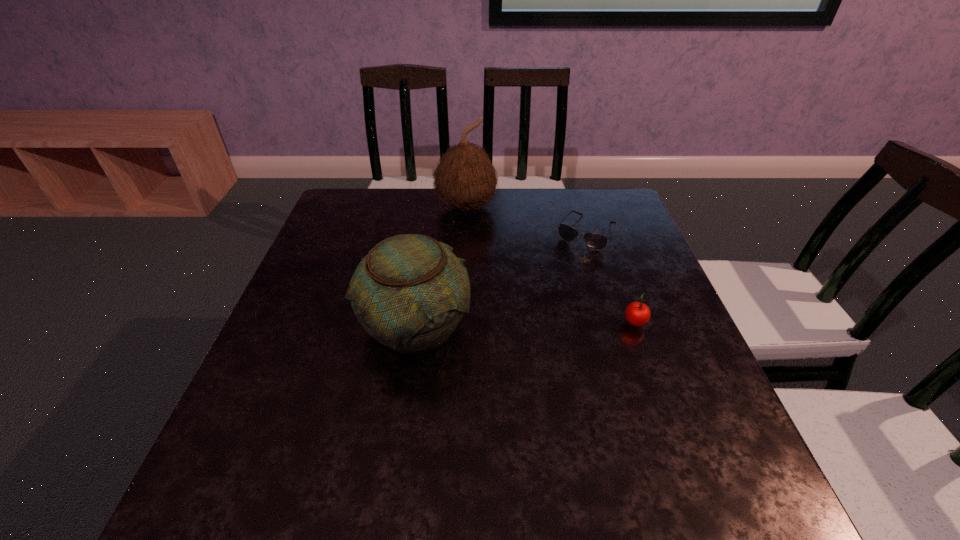
Where is `vacant space on the desktop that is between the second tallest object and the second shortest object and is positioned on the front-facing side of the sunglasses`? This screenshot has width=960, height=540. vacant space on the desktop that is between the second tallest object and the second shortest object and is positioned on the front-facing side of the sunglasses is located at coordinates (528, 325).

Locate an element on the screen. The width and height of the screenshot is (960, 540). vacant spot on the desktop that is between the pottery and the second shortest object and is positioned on the surface of the coconut is located at coordinates (498, 325).